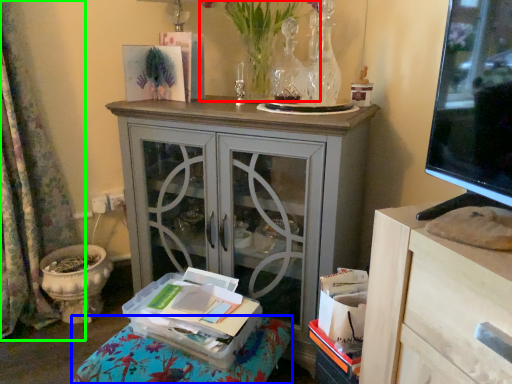
Question: Considering the real-world distances, which object is closest to floral arrangement (highlighted by a red box)? furniture (highlighted by a blue box) or curtain (highlighted by a green box).

Choices:
 (A) furniture
 (B) curtain

Answer: (B)